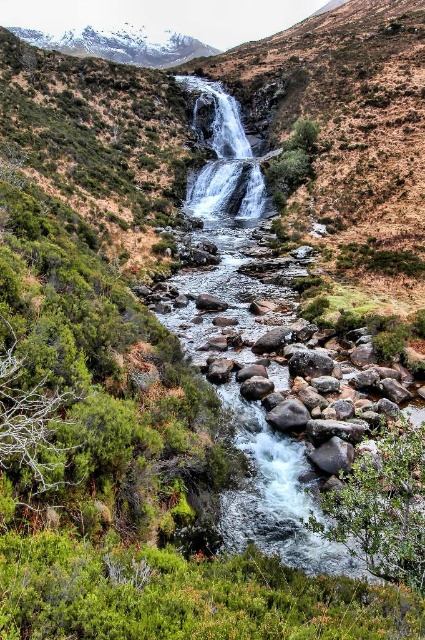
Question: Which point appears closest to the camera in this image?

Choices:
 (A) (263, 433)
 (B) (132, 36)

Answer: (A)

Question: Where is white smooth water at center located in relation to snowy granite mountain at upper left in the image?

Choices:
 (A) below
 (B) above

Answer: (A)

Question: Is the position of white smooth water at center more distant than that of snowy granite mountain at upper left?

Choices:
 (A) yes
 (B) no

Answer: (B)

Question: Which object appears farthest from the camera in this image?

Choices:
 (A) white smooth water at center
 (B) snowy granite mountain at upper left

Answer: (B)

Question: Does white smooth water at center come in front of snowy granite mountain at upper left?

Choices:
 (A) no
 (B) yes

Answer: (B)